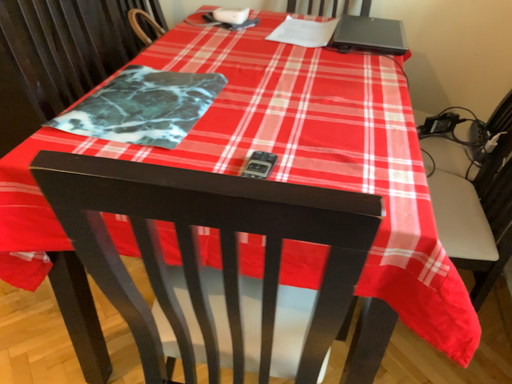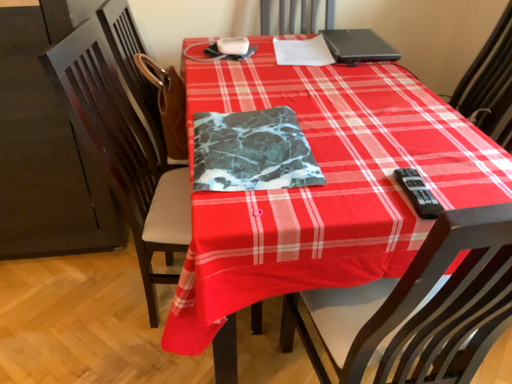
Question: Which way did the camera rotate in the video?

Choices:
 (A) rotated right
 (B) rotated left

Answer: (A)